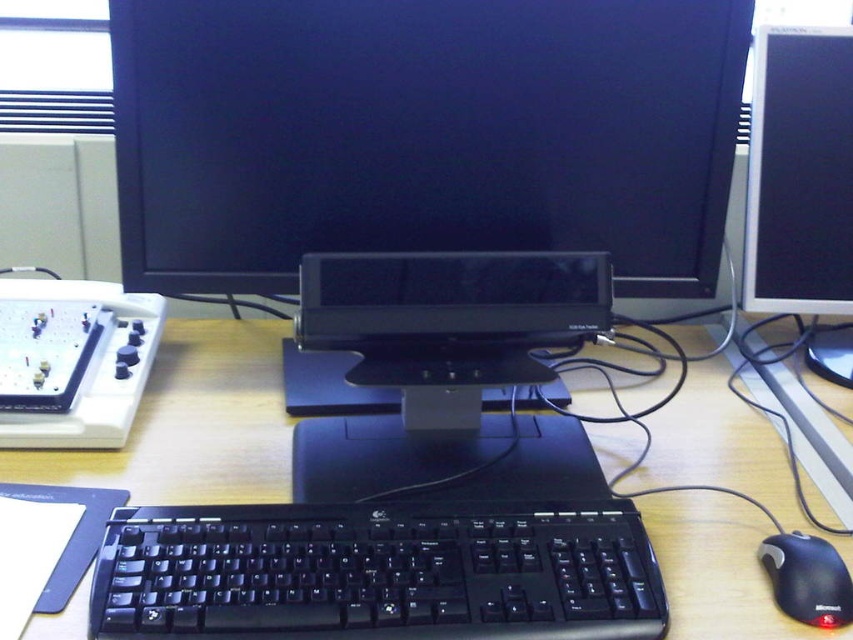
Can you confirm if black glossy monitor at center is positioned to the left of wooden desk at center?

In fact, black glossy monitor at center is to the right of wooden desk at center.

Which is above, black glossy monitor at center or wooden desk at center?

black glossy monitor at center is above.

Is point (659, 134) closer to camera compared to point (207, 321)?

Yes.

This screenshot has width=853, height=640. Find the location of `black glossy monitor at center`. black glossy monitor at center is located at coordinates coord(422,134).

Can you confirm if black plastic keyboard at center is wider than wooden desk at center?

Correct, the width of black plastic keyboard at center exceeds that of wooden desk at center.

Does point (563, 620) come farther from viewer compared to point (740, 442)?

No, it is in front of (740, 442).

Image resolution: width=853 pixels, height=640 pixels. Describe the element at coordinates (376, 572) in the screenshot. I see `black plastic keyboard at center` at that location.

Locate an element on the screen. black plastic keyboard at center is located at coordinates (376, 572).

Can you confirm if satin silver monitor at right is shorter than black plastic mouse at lower right?

No, satin silver monitor at right is not shorter than black plastic mouse at lower right.

Is satin silver monitor at right taller than black plastic mouse at lower right?

Yes.

Is point (766, 150) positioned behind point (834, 557)?

Yes, point (766, 150) is farther from viewer.

Find the location of a particular element. satin silver monitor at right is located at coordinates (799, 173).